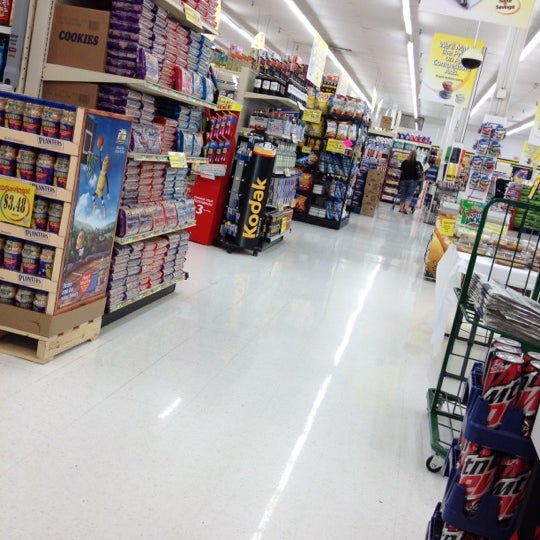
Image resolution: width=540 pixels, height=540 pixels. I want to click on column, so click(x=501, y=94).